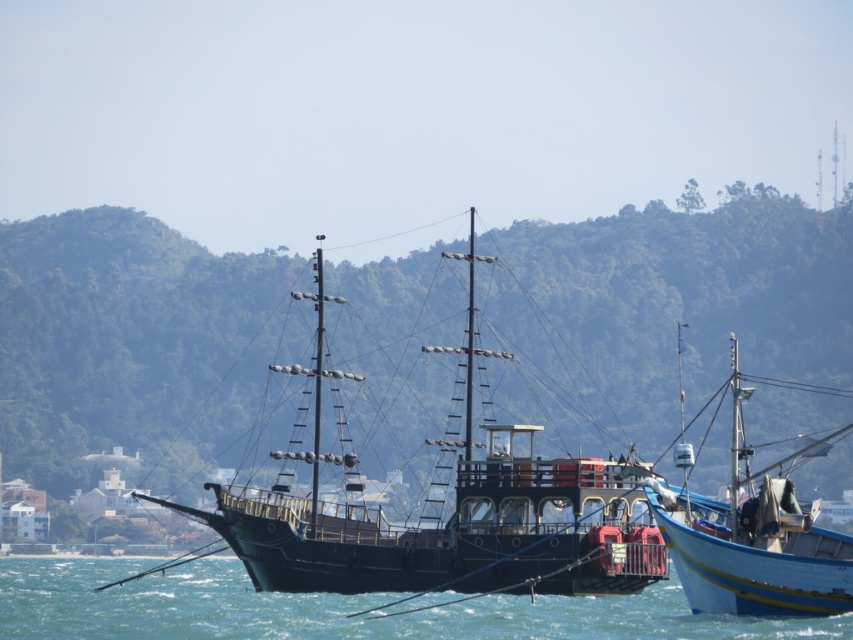
You are standing on the deck of the large dark ship and want to locate the blue water at center. In which direction should you look to see it?

You should look straight ahead because the blue water at center is located at point [334,609], which is directly in front of you.